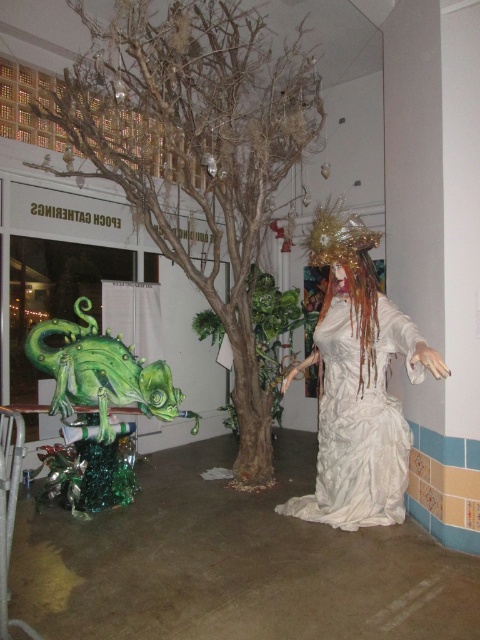
Between green metallic tree at center and white textured dress at center, which one has less height?

white textured dress at center

Between green metallic tree at center and white textured dress at center, which one appears on the right side from the viewer's perspective?

white textured dress at center is more to the right.

Is point (181, 240) positioned after point (359, 424)?

Yes.

Identify the location of green metallic tree at center. This screenshot has width=480, height=640. (197, 152).

Which is below, white textured dress at center or green glossy dragon at lower left?

white textured dress at center is below.

Is white textured dress at center thinner than green glossy dragon at lower left?

Yes.

What do you see at coordinates (360, 422) in the screenshot? The image size is (480, 640). I see `white textured dress at center` at bounding box center [360, 422].

I want to click on white textured dress at center, so click(360, 422).

Measure the distance from green metallic tree at center to green glossy dragon at lower left.

green metallic tree at center and green glossy dragon at lower left are 1.63 meters apart.

Looking at this image, which is above, green metallic tree at center or green glossy dragon at lower left?

green metallic tree at center is higher up.

Image resolution: width=480 pixels, height=640 pixels. What do you see at coordinates (197, 152) in the screenshot? I see `green metallic tree at center` at bounding box center [197, 152].

Image resolution: width=480 pixels, height=640 pixels. I want to click on green metallic tree at center, so click(x=197, y=152).